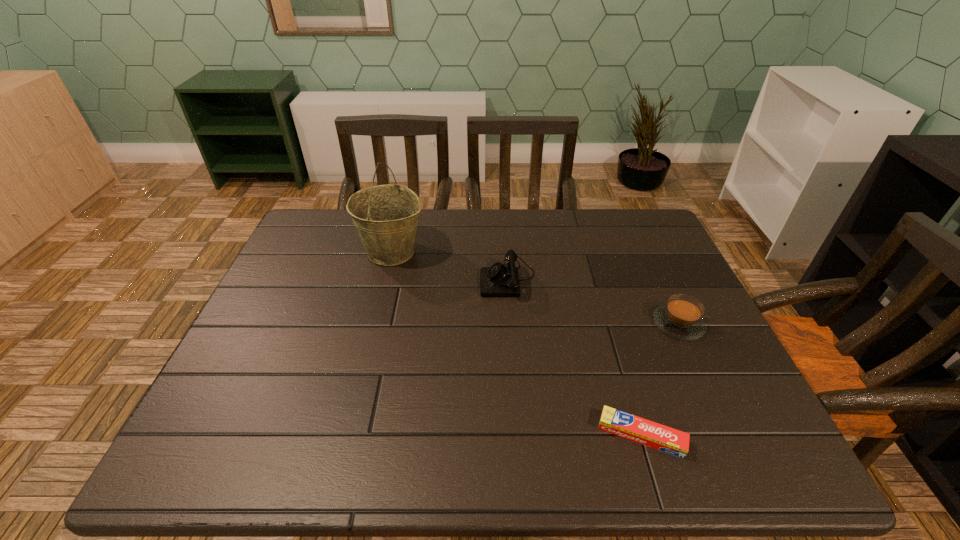
I want to click on the tallest object, so click(x=386, y=217).

Find the location of a particular element. This screenshot has width=960, height=540. the leftmost object is located at coordinates (x=386, y=217).

Find the location of `the second object from left to right`. the second object from left to right is located at coordinates (499, 280).

Locate an element on the screen. telephone is located at coordinates (499, 280).

Locate an element on the screen. The height and width of the screenshot is (540, 960). the third tallest object is located at coordinates (681, 318).

I want to click on cappuccino, so click(681, 318).

You are a GUI agent. You are given a task and a screenshot of the screen. Output one action in this format:
    pyautogui.click(x=<x>, y=<y>)
    Task: Click on the nearest object
    
    Given the screenshot: What is the action you would take?
    pyautogui.click(x=663, y=438)

This screenshot has height=540, width=960. I want to click on the shortest object, so click(663, 438).

The image size is (960, 540). Find the location of `free point located on the front of the wine bucket`. free point located on the front of the wine bucket is located at coordinates (358, 392).

Identify the location of vacant area situated on the front face of the second tallest object. (451, 278).